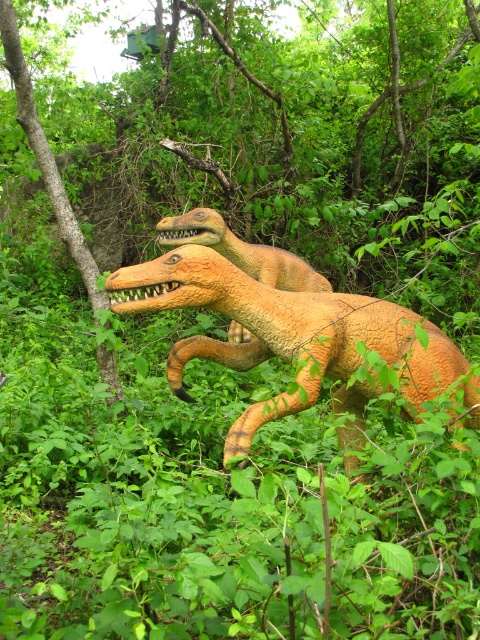
Which of these two, orange textured dinosaur at center or orange matte dinosaur at center, stands shorter?

With less height is orange matte dinosaur at center.

Is orange textured dinosaur at center closer to the viewer compared to orange matte dinosaur at center?

Yes, it is in front of orange matte dinosaur at center.

Does point (361, 387) come behind point (210, 227)?

No, (361, 387) is closer to viewer.

The height and width of the screenshot is (640, 480). Find the location of `orange textured dinosaur at center`. orange textured dinosaur at center is located at coordinates (283, 332).